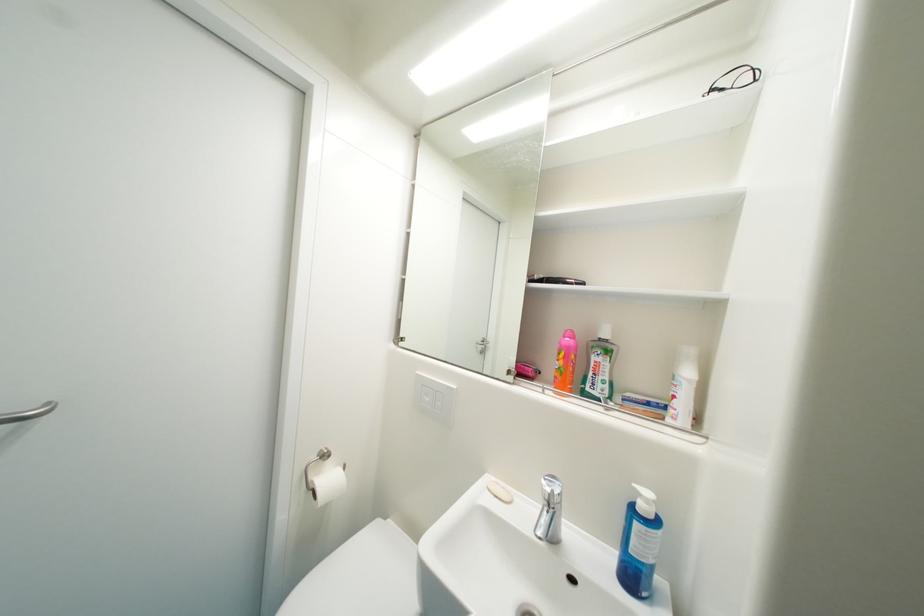
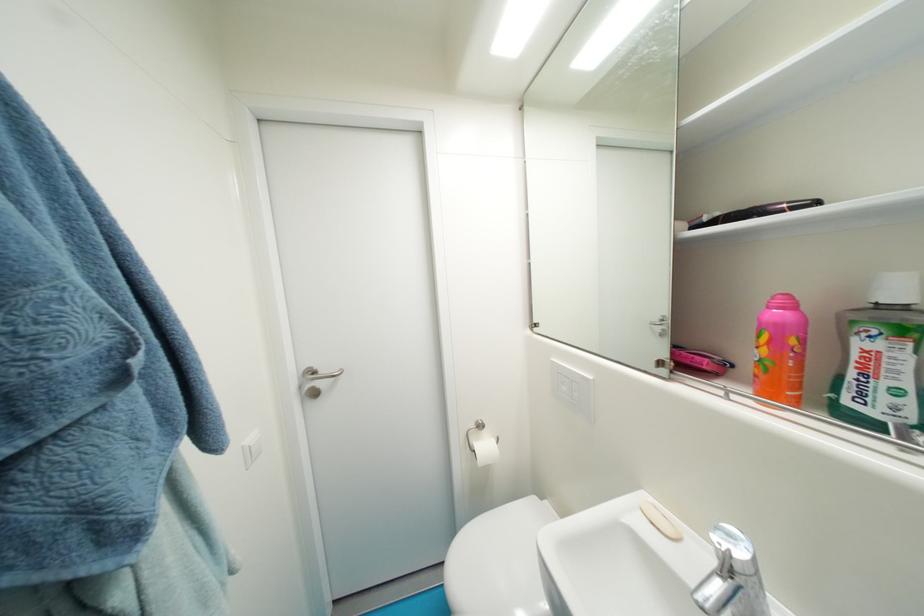
In the second image, find the point that corresponds to (548,278) in the first image.

(724, 216)